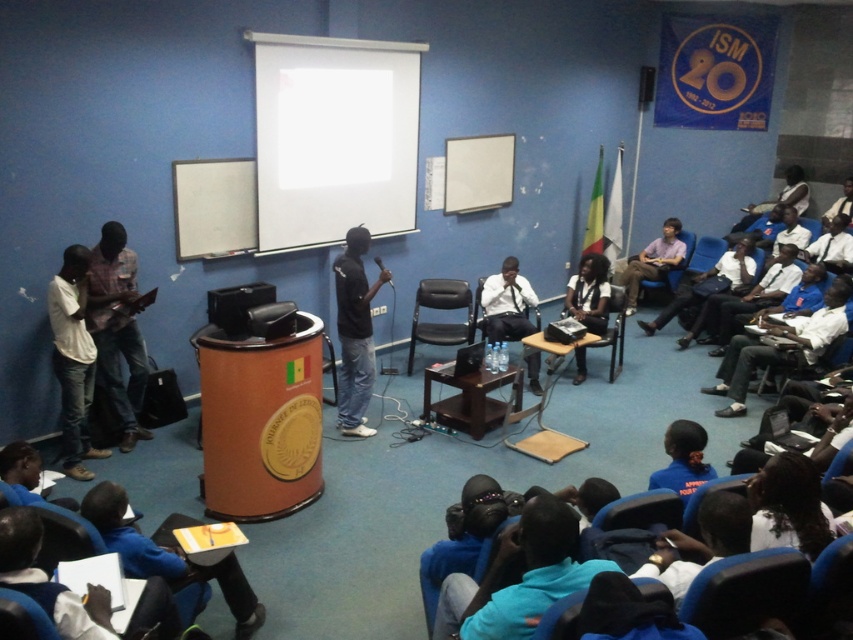
Question: Which point is farther from the camera taking this photo?

Choices:
 (A) (514, 278)
 (B) (738, 605)

Answer: (A)

Question: Can you confirm if black matte shirt at center is smaller than blue fabric chair at lower center?

Choices:
 (A) no
 (B) yes

Answer: (A)

Question: Estimate the real-world distances between objects in this image. Which object is farther from the matte black shirt at center?

Choices:
 (A) white cotton shirt at left
 (B) blue fabric chair at lower right

Answer: (B)

Question: Which of the following is the closest to the observer?

Choices:
 (A) (77, 244)
 (B) (596, 520)
 (C) (799, 561)
 (D) (42, 625)

Answer: (D)

Question: Does blue fabric chair at lower right appear under dark blue fabric chair at lower left?

Choices:
 (A) yes
 (B) no

Answer: (B)

Question: Is white matte projection screen at upper center smaller than plaid fabric shirt at left?

Choices:
 (A) yes
 (B) no

Answer: (B)